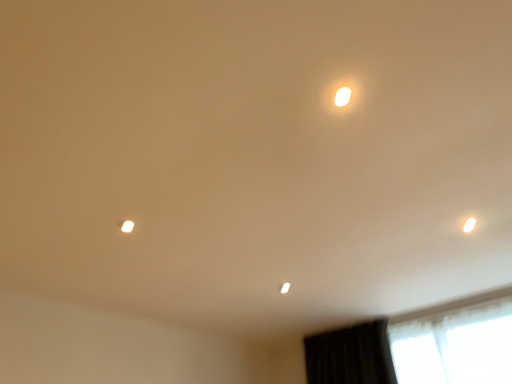
Where is `white glossy lampshade at lower right`? This screenshot has width=512, height=384. white glossy lampshade at lower right is located at coordinates (469, 225).

The image size is (512, 384). What do you see at coordinates (469, 225) in the screenshot? I see `white glossy lampshade at lower right` at bounding box center [469, 225].

Locate an element on the screen. This screenshot has height=384, width=512. white glossy lampshade at lower right is located at coordinates (469, 225).